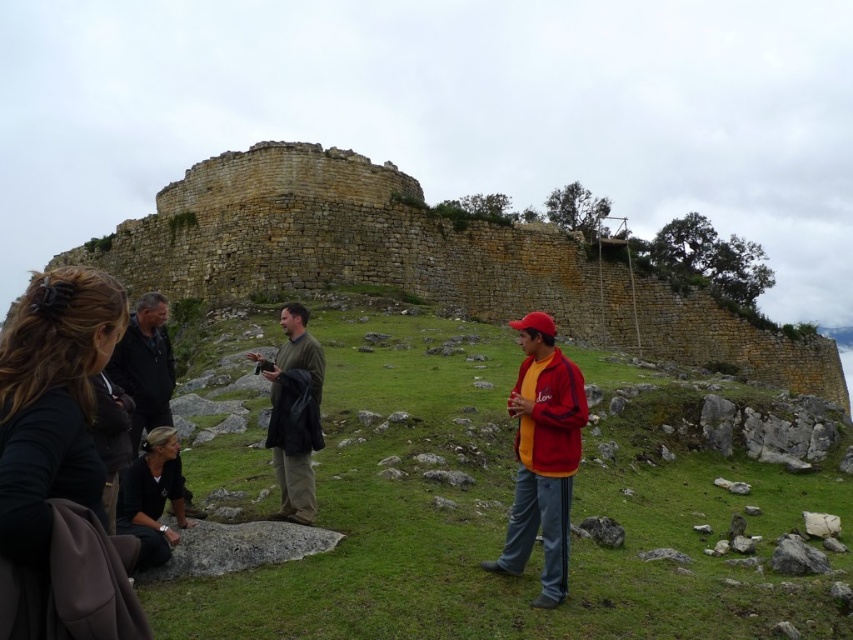
You are a photographer trying to capture a photo of the green matte shirt at center and the black fabric bag at lower left. Which object should you focus on first to ensure both are in sharp focus?

The black fabric bag at lower left is closer to the viewer than the green matte shirt at center. To ensure both are in sharp focus, you should focus on the black fabric bag at lower left first, as it is the closer object.

You are a photographer positioned at the origin point of the image. You want to take a photo of the green matte shirt at center. Which direction should you move to get the shirt into the frame?

The green matte shirt at center is located at coordinates point (288, 412). Since the photographer is at the origin, moving towards the positive x and y directions would bring the shirt into the frame.